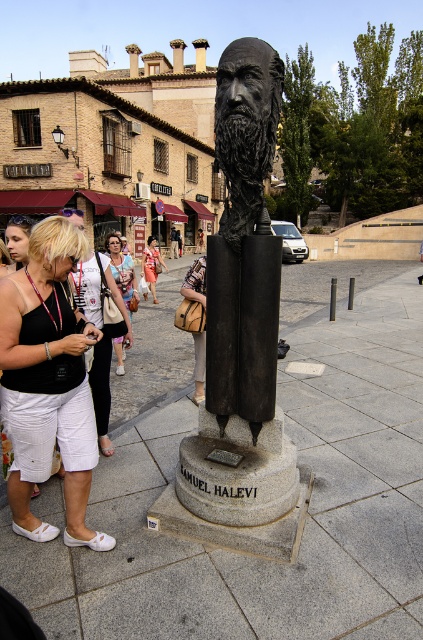
Can you confirm if black polished stone bust at center is shorter than denim skirt at center?

Correct, black polished stone bust at center is not as tall as denim skirt at center.

Who is positioned more to the left, black polished stone bust at center or denim skirt at center?

From the viewer's perspective, denim skirt at center appears more on the left side.

Does point (244, 70) lie in front of point (151, 259)?

Yes, point (244, 70) is closer to viewer.

This screenshot has height=640, width=423. Identify the location of black polished stone bust at center. (241, 340).

Can you confirm if matte black tank top at lower left is positioned to the right of blonde hair woman at left?

Yes, matte black tank top at lower left is to the right of blonde hair woman at left.

Is matte black tank top at lower left wider than blonde hair woman at left?

Yes.

Find the location of `matte black tank top at lower left`. matte black tank top at lower left is located at coordinates (47, 381).

Where is `matte black tank top at lower left`? The image size is (423, 640). matte black tank top at lower left is located at coordinates (47, 381).

Between leather brown bag at lower center and denim skirt at center, which one is positioned higher?

denim skirt at center

Is leather brown bag at lower center to the right of denim skirt at center from the viewer's perspective?

Yes, leather brown bag at lower center is to the right of denim skirt at center.

The height and width of the screenshot is (640, 423). Find the location of `leather brown bag at lower center`. leather brown bag at lower center is located at coordinates (195, 282).

The width and height of the screenshot is (423, 640). In order to click on leather brown bag at lower center in this screenshot , I will do `click(195, 282)`.